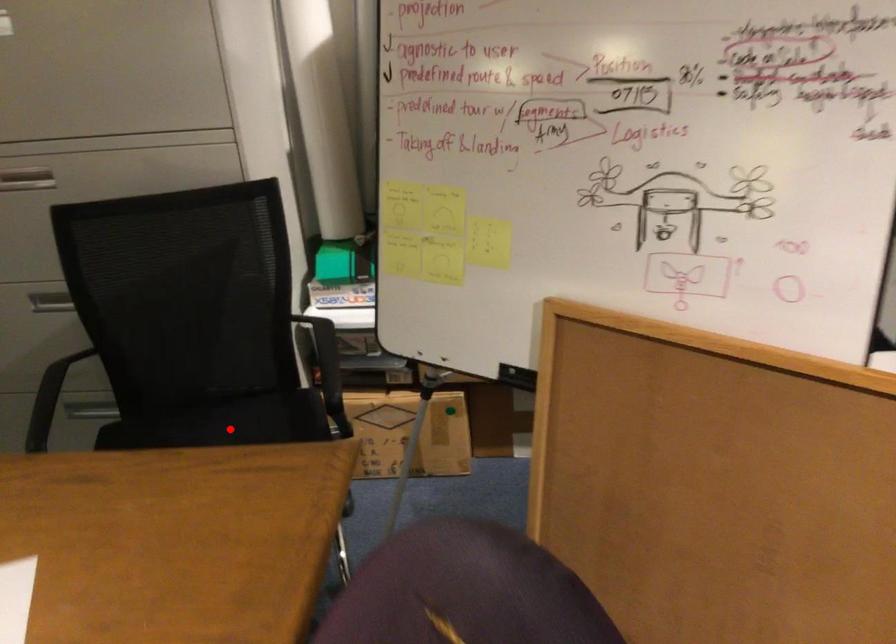
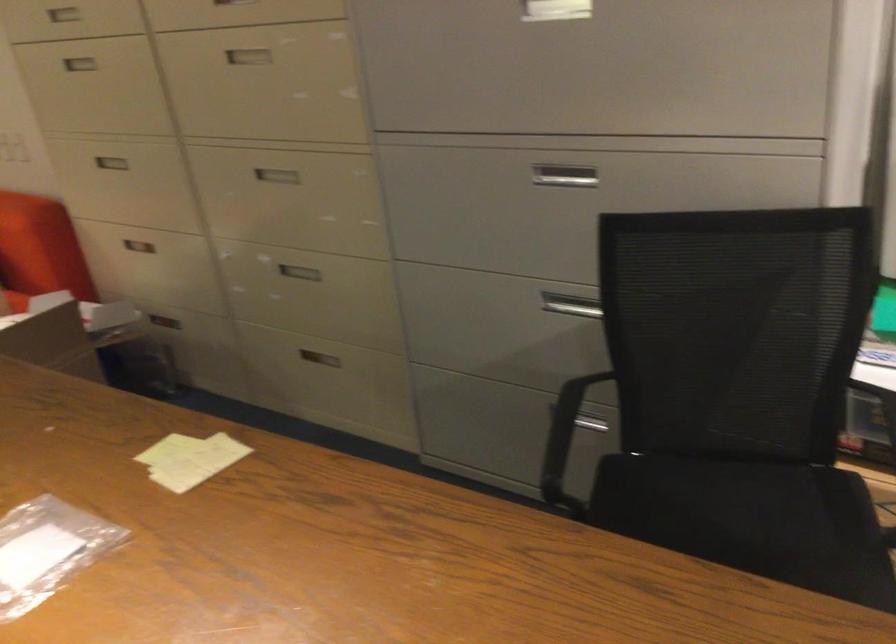
Question: I am providing you with two images of the same scene from different viewpoints. Image1 has a red point marked. In image2, the corresponding 3D location appears at what relative position? Reply with the corresponding letter.

Choices:
 (A) Closer
 (B) Farther

Answer: (A)